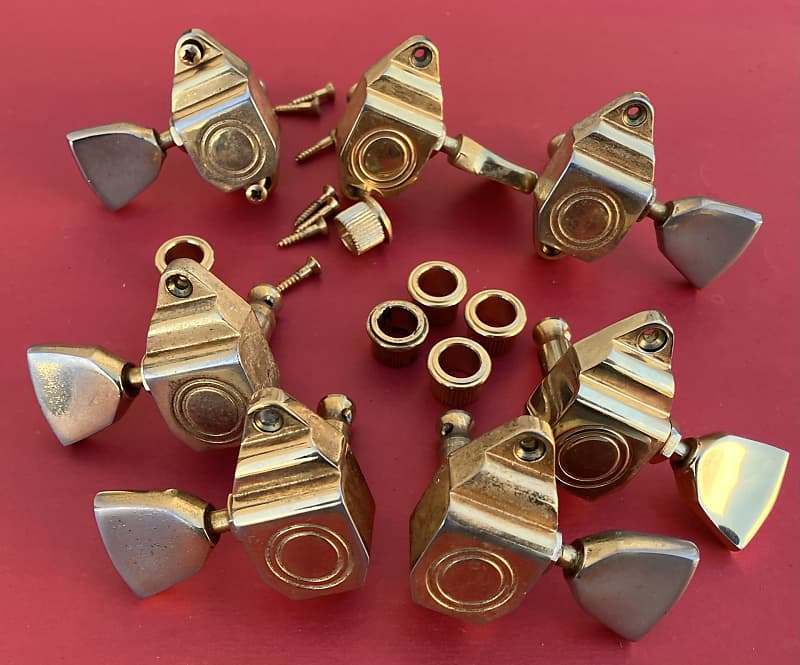
This screenshot has height=665, width=800. Find the location of `red counter`. red counter is located at coordinates (72, 282).